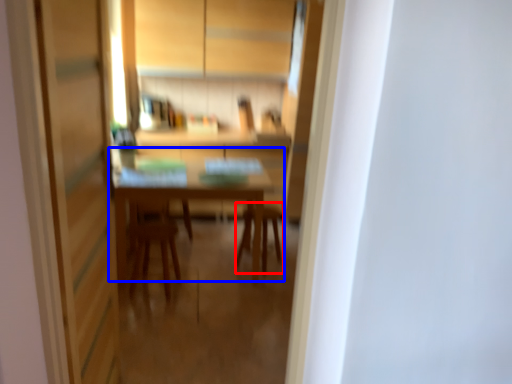
Question: Which object is further to the camera taking this photo, chair (highlighted by a red box) or table (highlighted by a blue box)?

Choices:
 (A) chair
 (B) table

Answer: (A)